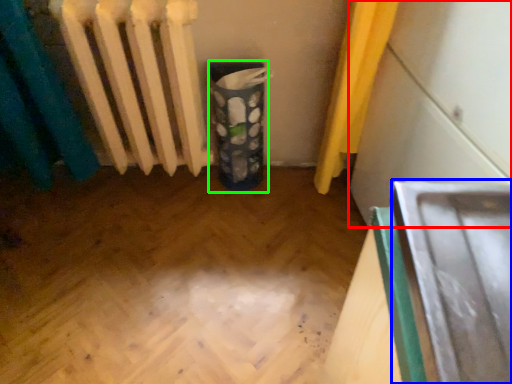
Question: Which is farther away from wide (highlighted by a red box)? wide (highlighted by a blue box) or recycling bin (highlighted by a green box)?

Choices:
 (A) wide
 (B) recycling bin

Answer: (A)